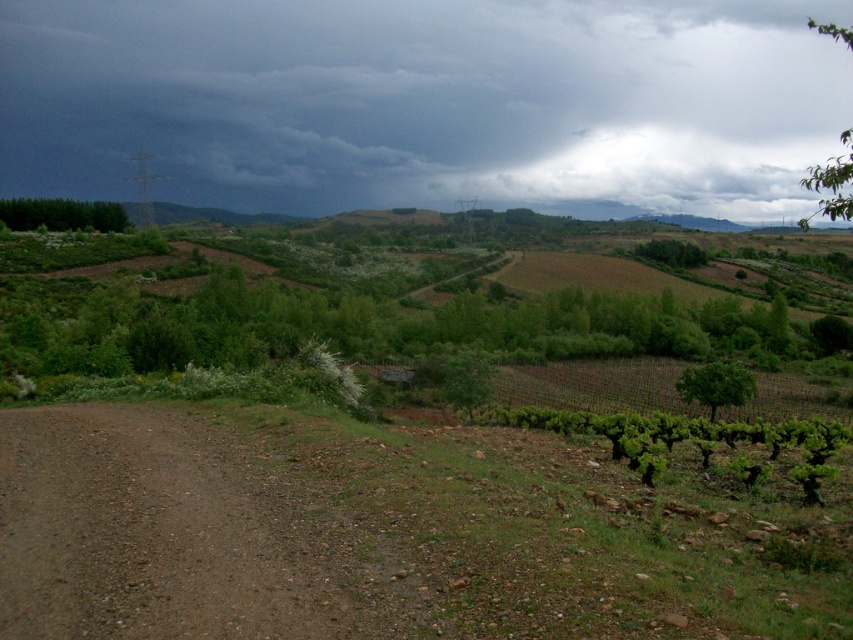
Question: Estimate the real-world distances between objects in this image. Which object is farther from the green leafy tree at upper right?

Choices:
 (A) green leafy tree at center-right
 (B) green leafy trees at left
 (C) brown gravel road at lower left

Answer: (B)

Question: Which point is farther to the camera?

Choices:
 (A) (654, 244)
 (B) (848, 170)

Answer: (A)

Question: Can you confirm if brown gravel road at lower left is positioned to the left of green leafy tree at center-right?

Choices:
 (A) no
 (B) yes

Answer: (B)

Question: Based on their relative distances, which object is farther from the green leafy tree at upper right?

Choices:
 (A) dark gray cloud at upper center
 (B) green leafy tree at center-right
 (C) green leafy tree at center
 (D) brown gravel road at lower left

Answer: (A)

Question: Does dark gray cloud at upper center appear over green leafy tree at center-right?

Choices:
 (A) no
 (B) yes

Answer: (B)

Question: Is green leafy tree at upper right positioned before green leafy tree at center?

Choices:
 (A) yes
 (B) no

Answer: (A)